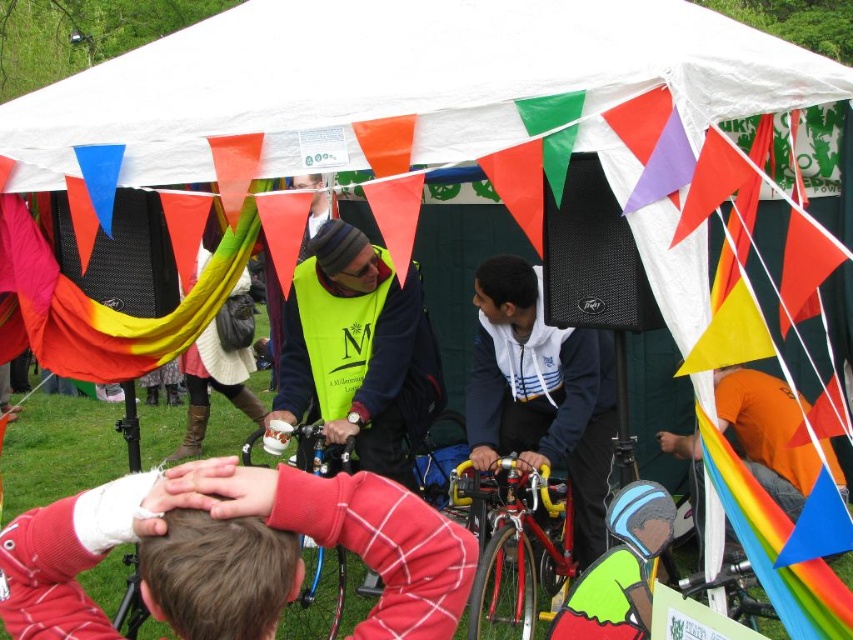
Can you confirm if red plaid shirt at center is positioned to the right of white matte jacket at center?

Incorrect, red plaid shirt at center is not on the right side of white matte jacket at center.

Based on the photo, between red plaid shirt at center and white matte jacket at center, which one has more height?

white matte jacket at center

Where is `red plaid shirt at center`? The height and width of the screenshot is (640, 853). red plaid shirt at center is located at coordinates (231, 552).

This screenshot has width=853, height=640. Identify the location of white matte jacket at center. (541, 394).

Is point (508, 429) closer to viewer compared to point (480, 536)?

That is False.

Based on the photo, who is more forward, [527,444] or [541,486]?

Point [541,486] is in front.

You are a GUI agent. You are given a task and a screenshot of the screen. Output one action in this format:
    pyautogui.click(x=<x>, y=<y>)
    Task: Click on the white matte jacket at center
    
    Given the screenshot: What is the action you would take?
    pyautogui.click(x=541, y=394)

Is red plaid shirt at center below neon yellow vest at center?

Yes.

This screenshot has width=853, height=640. What do you see at coordinates (231, 552) in the screenshot? I see `red plaid shirt at center` at bounding box center [231, 552].

Between point (195, 593) and point (413, 403), which one is positioned behind?

Positioned behind is point (413, 403).

The width and height of the screenshot is (853, 640). Find the location of `red plaid shirt at center`. red plaid shirt at center is located at coordinates (231, 552).